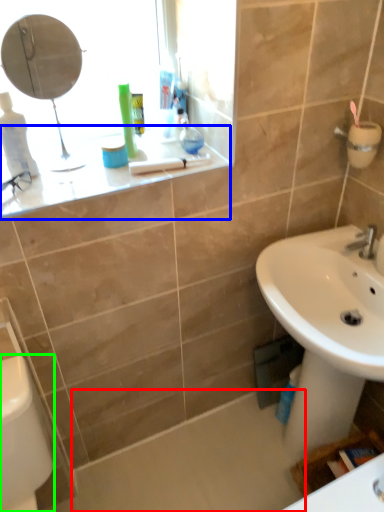
Question: Which is farther away from bath (highlighted by a red box)? counter top (highlighted by a blue box) or porcelain (highlighted by a green box)?

Choices:
 (A) counter top
 (B) porcelain

Answer: (A)